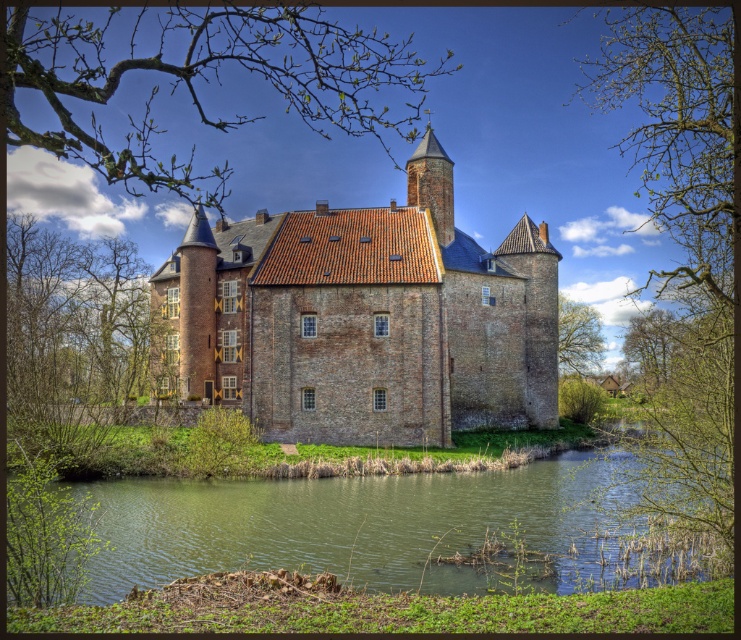
Question: Which of the following is the closest to the observer?

Choices:
 (A) green leafy tree at left
 (B) green grassy river at lower center

Answer: (B)

Question: Is green grassy river at lower center above bare branches at upper left?

Choices:
 (A) no
 (B) yes

Answer: (A)

Question: Which object appears closest to the camera in this image?

Choices:
 (A) green leafy branches at upper left
 (B) green grassy river at lower center
 (C) brown brick castle at center
 (D) green leafy tree at right

Answer: (A)

Question: Among these objects, which one is nearest to the camera?

Choices:
 (A) green grassy river at lower center
 (B) green leafy tree at upper right
 (C) brown brick castle at center
 (D) green leafy tree at right

Answer: (A)

Question: Is bare branches at upper left smaller than green leafy tree at upper right?

Choices:
 (A) yes
 (B) no

Answer: (B)

Question: Does green grassy river at lower center have a lesser width compared to green leafy tree at left?

Choices:
 (A) no
 (B) yes

Answer: (A)